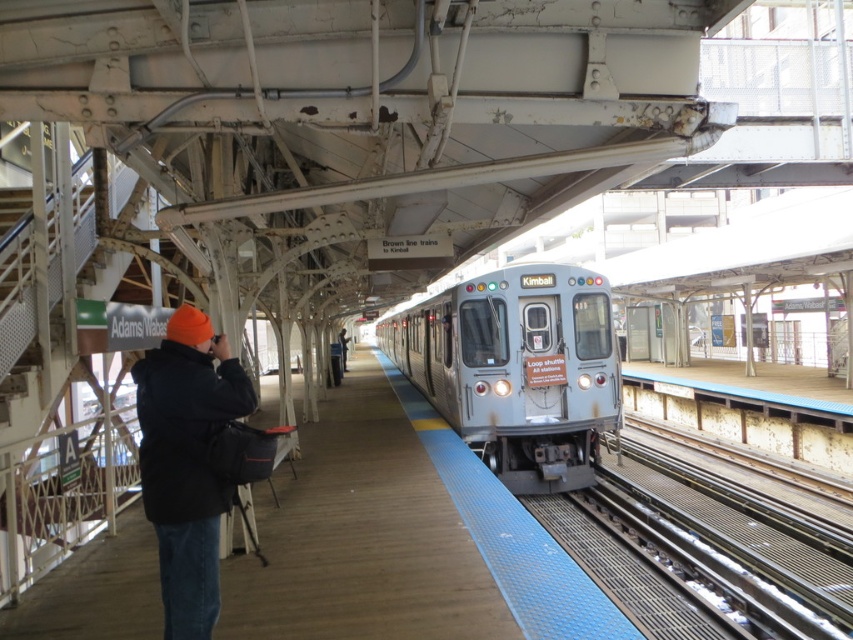
Measure the distance between silver metallic train at center and black jacket at center.

silver metallic train at center and black jacket at center are 7.52 meters apart from each other.

Which is behind, point (457, 381) or point (344, 358)?

The point (344, 358) is behind.

Identify the location of silver metallic train at center. This screenshot has height=640, width=853. (517, 369).

Can you confirm if silver metallic train at center is smaller than black fleece jacket at left?

Actually, silver metallic train at center might be larger than black fleece jacket at left.

You are a GUI agent. You are given a task and a screenshot of the screen. Output one action in this format:
    pyautogui.click(x=<x>, y=<y>)
    Task: Click on the silver metallic train at center
    
    Given the screenshot: What is the action you would take?
    pyautogui.click(x=517, y=369)

The image size is (853, 640). Identify the location of silver metallic train at center. (517, 369).

This screenshot has width=853, height=640. Identify the location of silver metallic train at center. (517, 369).

Does blue textured platform at center lie behind black jacket at center?

That is False.

Is blue textured platform at center bigger than black jacket at center?

No.

At what (x,y) coordinates should I click in order to perform the action: click on blue textured platform at center. Please return your answer as a coordinate pair (x, y). This screenshot has height=640, width=853. Looking at the image, I should click on click(401, 538).